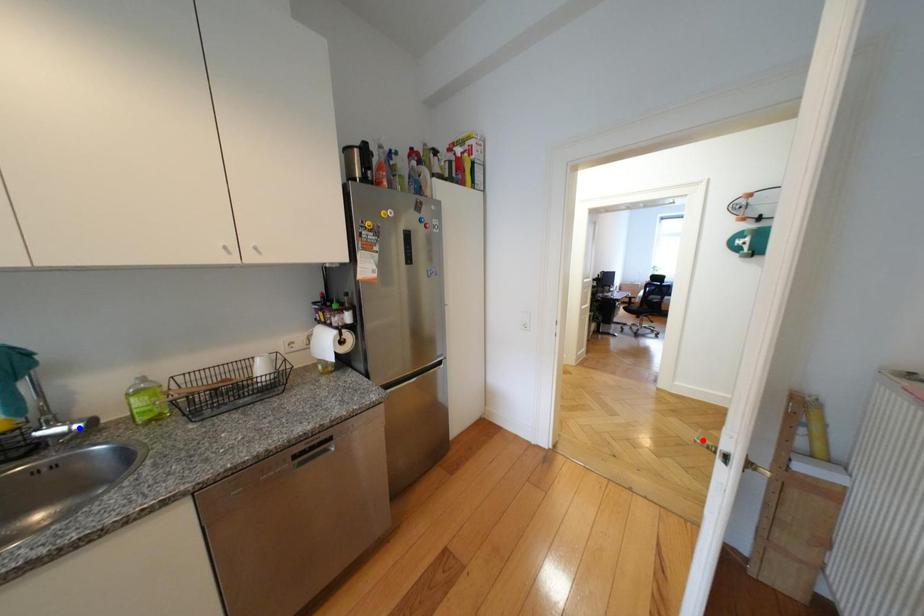
Question: Two points are marked on the image. Which point is closer to the camera?

Choices:
 (A) Blue point is closer.
 (B) Red point is closer.

Answer: (A)